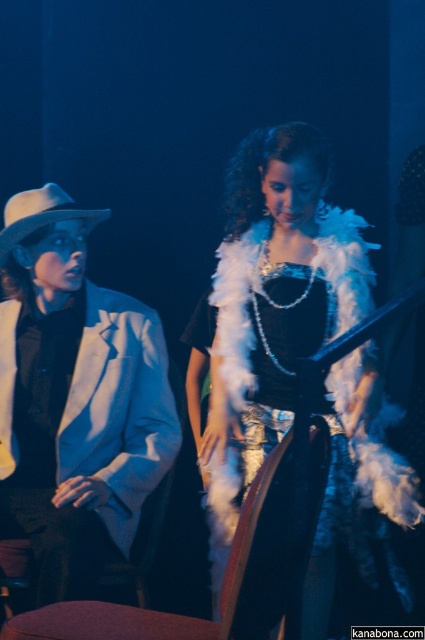
You are a photographer at a costume party. You want to take a photo that clearly shows both the white fluffy dress at center and the white felt cowboy hat at left. However, the lighting is very dim. What should you adjust to ensure both objects are visible?

Since the white fluffy dress at center is in front of the white felt cowboy hat at left, you should adjust the lighting to highlight the dress first, then ensure the cowboy hat is illuminated enough to be distinguishable behind it.

You are a costume designer reviewing a performance scene. You notice the white matte jacket at left and the white felt cowboy hat at left. Which of these two items is positioned lower on the performer?

The white matte jacket at left is below the white felt cowboy hat at left, so the white matte jacket at left is positioned lower on the performer.

You are a photographer at a themed event. You need to position a spotlight on the white fluffy dress at center without shining it on the white felt cowboy hat at left. Based on their positions, is this possible?

The white fluffy dress at center is located below the white felt cowboy hat at left, so positioning the spotlight directly below the hat would illuminate the dress without affecting the hat.